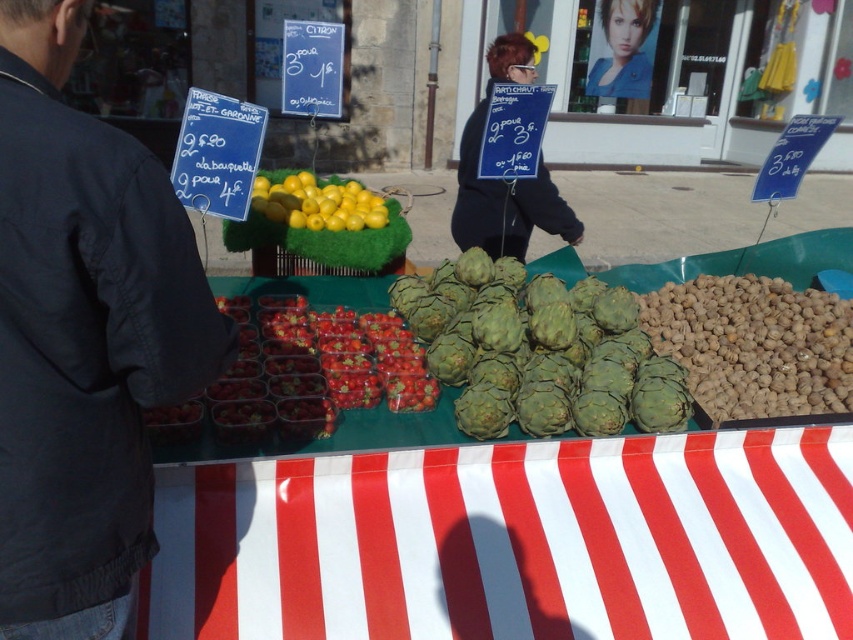
You are a customer at the market stall and want to buy the yellow smooth lemons at center. The vendor tells you that the sign for the price is located near the smooth blonde hair at upper center. To find the sign, should you look to your left or right relative to the lemons?

The yellow smooth lemons at center is to the left of smooth blonde hair at upper center. Therefore, to locate the sign near the smooth blonde hair at upper center, you should look to your right relative to the lemons.

You are a customer at the market stall and want to buy the item listed on the dark blue fabric sign at center and the smooth blonde hair at upper center. Which item is located to the right of the other?

The dark blue fabric sign at center is to the left of smooth blonde hair at upper center, so the smooth blonde hair at upper center is located to the right of the dark blue fabric sign at center.